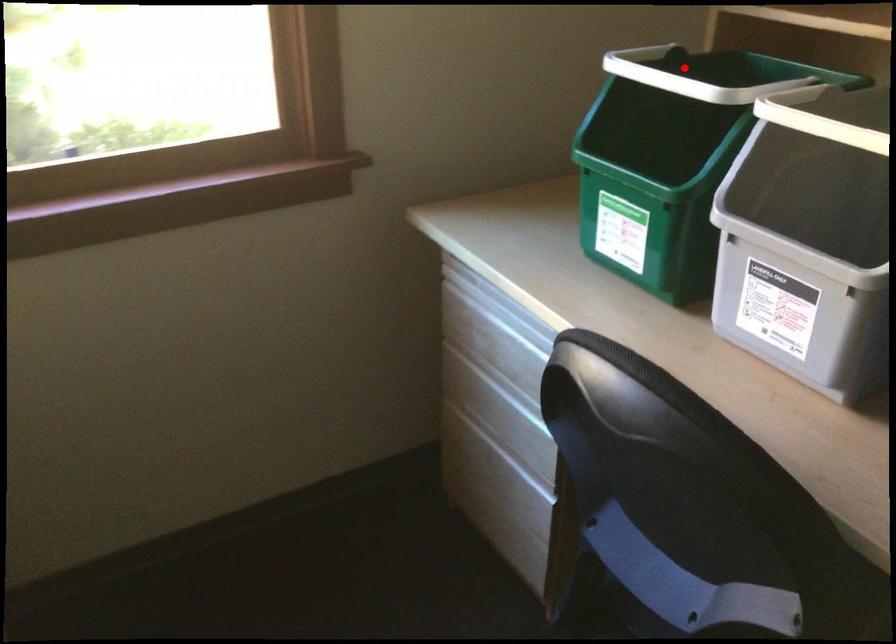
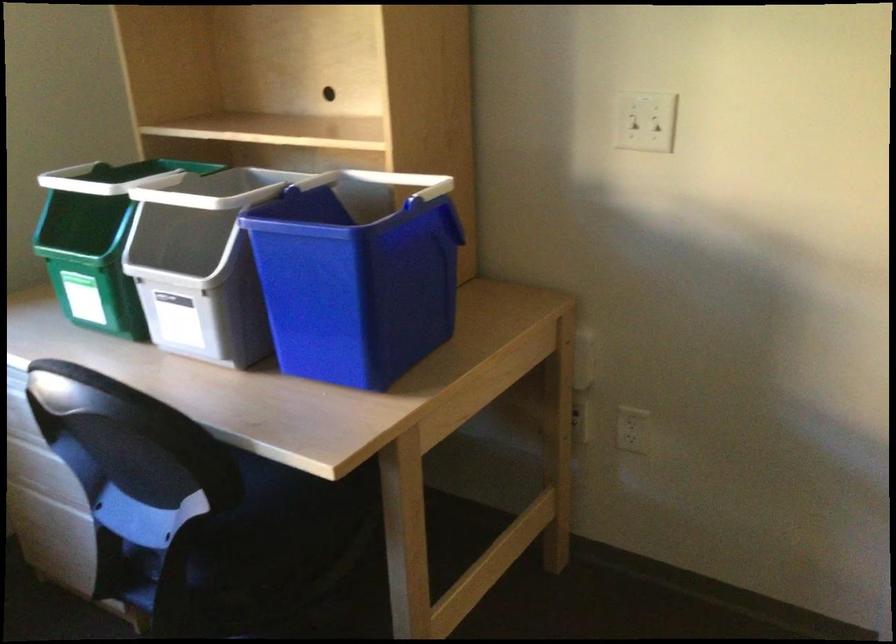
Question: I am providing you with two images of the same scene from different viewpoints. In image1, a red point is highlighted. Considering the same 3D point in image2, which of the following is correct?

Choices:
 (A) It is closer
 (B) It is farther

Answer: (B)